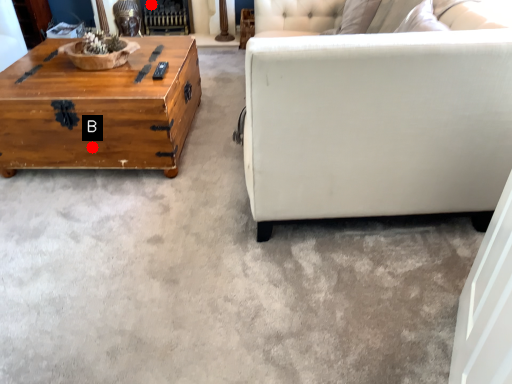
Question: Two points are circled on the image, labeled by A and B beside each circle. Which of the following is the farthest from the observer?

Choices:
 (A) A is further
 (B) B is further

Answer: (A)